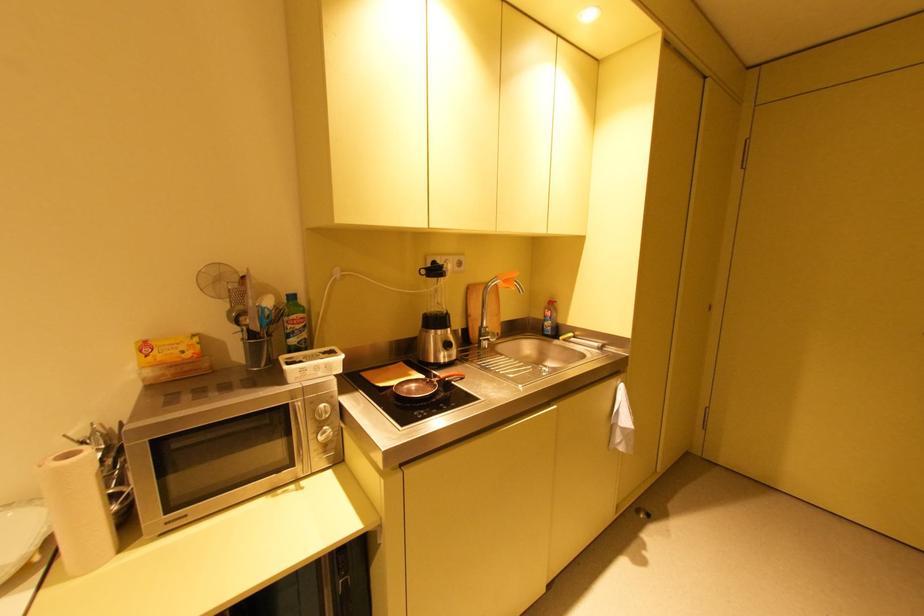
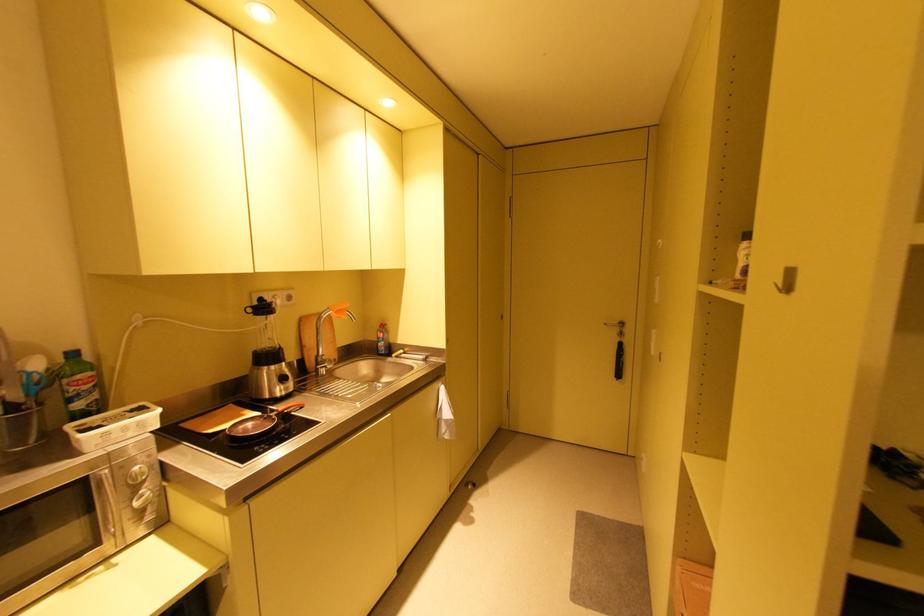
Question: How did the camera likely rotate?

Choices:
 (A) Left
 (B) Right
 (C) Up
 (D) Down

Answer: (B)